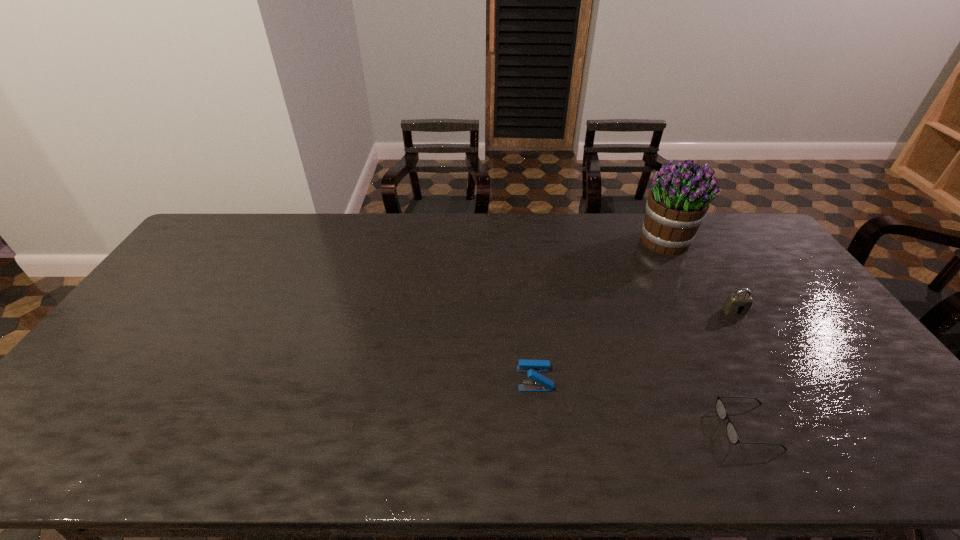
Where is `empty space between the third tallest object and the second farthest object`? The height and width of the screenshot is (540, 960). empty space between the third tallest object and the second farthest object is located at coordinates (635, 345).

Locate an element on the screen. Image resolution: width=960 pixels, height=540 pixels. vacant space that's between the tallest object and the third nearest object is located at coordinates (699, 276).

Where is `vacant space that's between the padlock and the shortest object`? This screenshot has width=960, height=540. vacant space that's between the padlock and the shortest object is located at coordinates (741, 369).

Find the location of a particular element. This screenshot has width=960, height=540. free space between the tallest object and the second shortest object is located at coordinates (599, 310).

You are a GUI agent. You are given a task and a screenshot of the screen. Output one action in this format:
    pyautogui.click(x=<x>, y=<y>)
    Task: Click on the empty space that is in between the tallest object and the shortest object
    The image size is (960, 540).
    Given the screenshot: What is the action you would take?
    pyautogui.click(x=706, y=334)

Identify the location of vacant point located between the spectacles and the tallest object. (706, 334).

Identify the location of blank region between the tallest object and the shortest object. This screenshot has height=540, width=960. (706, 334).

Find the location of a particular element. This screenshot has width=960, height=540. vacant space that is in between the third nearest object and the stapler is located at coordinates (635, 345).

In order to click on free space between the leftmost object and the padlock in this screenshot , I will do `click(635, 345)`.

Identify the location of vacant space in between the spectacles and the second shortest object. (641, 403).